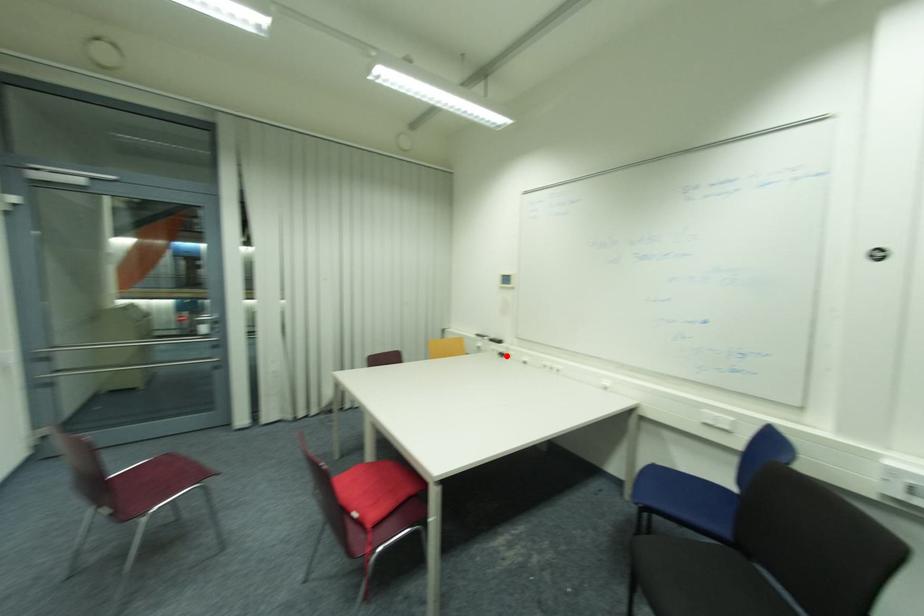
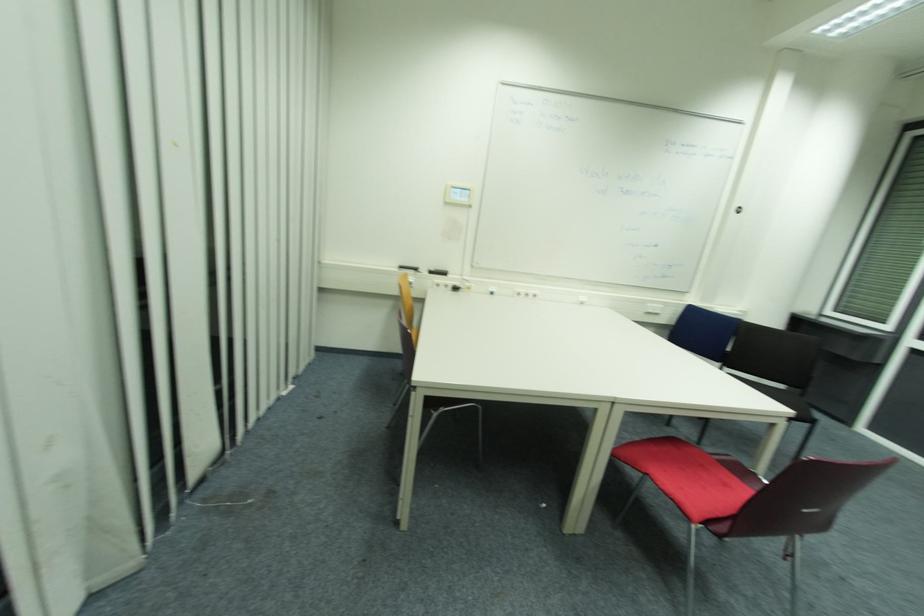
The point at the highlighted location is marked in the first image. Where is the corresponding point in the second image?

(458, 290)